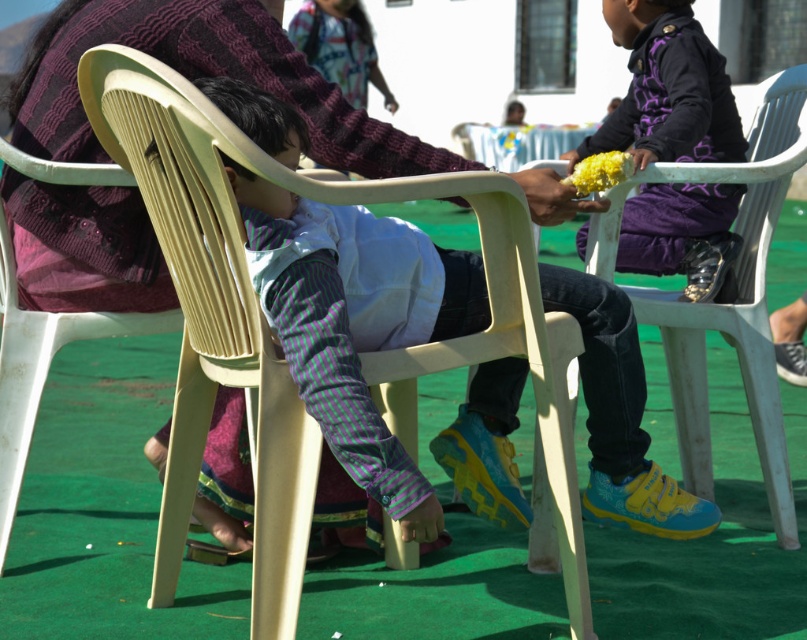
Does point (178, 109) come closer to viewer compared to point (646, 157)?

That is True.

Identify the location of beige plastic chair at center. This screenshot has height=640, width=807. coord(274,349).

Is beige plastic chair at center taller than white plastic chair at right?

In fact, beige plastic chair at center may be shorter than white plastic chair at right.

This screenshot has width=807, height=640. What do you see at coordinates (274, 349) in the screenshot?
I see `beige plastic chair at center` at bounding box center [274, 349].

I want to click on beige plastic chair at center, so click(x=274, y=349).

Can you confirm if matte yellow flower at center is positioned to the left of yellow matte flower at center?

Correct, you'll find matte yellow flower at center to the left of yellow matte flower at center.

Who is more forward, (x=529, y=202) or (x=584, y=188)?

Positioned in front is point (x=529, y=202).

Which is behind, point (563, 212) or point (626, 172)?

The point (626, 172) is behind.

I want to click on matte yellow flower at center, so pyautogui.click(x=552, y=196).